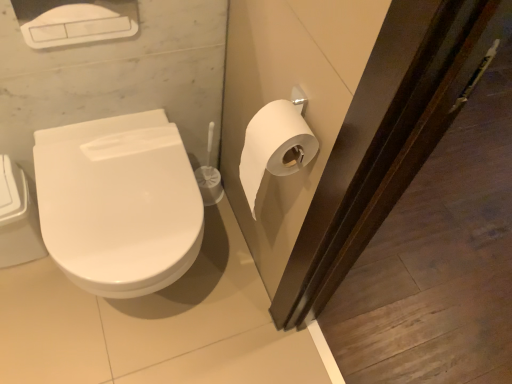
I want to click on empty space that is ontop of white glossy toilet at left (from a real-world perspective), so click(x=103, y=200).